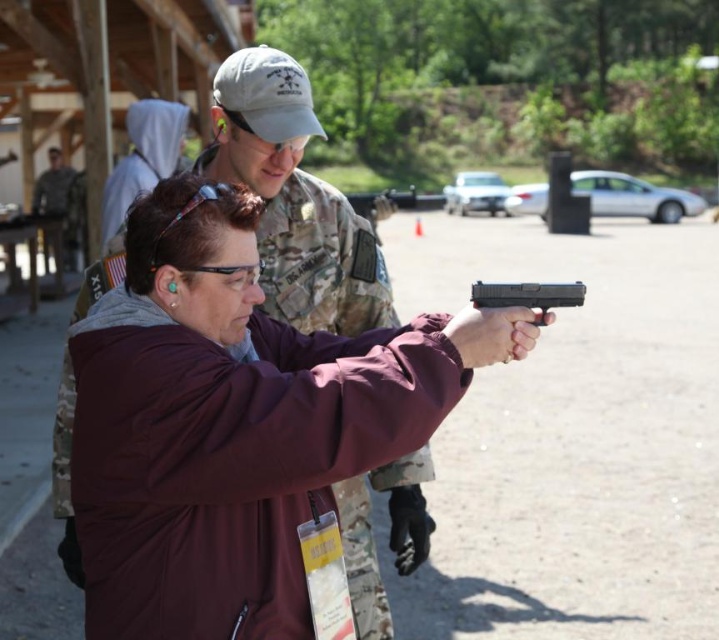
You are a safety officer at the shooting range. You notice the maroon fabric jacket at center and the camouflage uniform at center in the scene. Which of these items is positioned lower from the ground?

The maroon fabric jacket at center is positioned below the camouflage uniform at center, so the maroon fabric jacket at center is lower from the ground.

You are a safety officer at a shooting range. You need to ensure that all participants are using the correct equipment. The black plastic handgun at center and camouflage uniform at center are both in use. Which item is smaller in size?

→ The black plastic handgun at center is smaller than the camouflage uniform at center.

You are a safety officer at the shooting range. You must ensure that all participants are positioned safely. You notice two points marked on the range map at coordinates point (535, 284) and point (42, 186). According to the range map, which point is closer to the shooter in the foreground?

Point (535, 284) is in front of point (42, 186), so the shooter in the foreground is closer to point (535, 284).